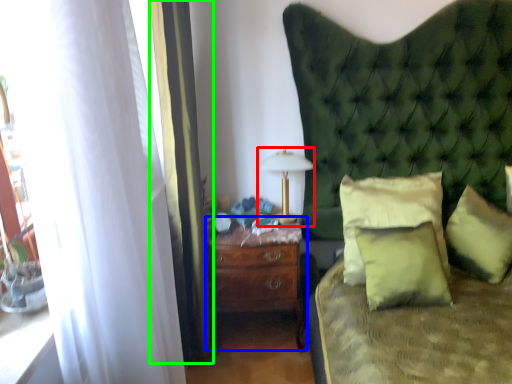
Question: Which is nearer to the bedside lamp (highlighted by a red box)? nightstand (highlighted by a blue box) or curtain (highlighted by a green box).

Choices:
 (A) nightstand
 (B) curtain

Answer: (A)